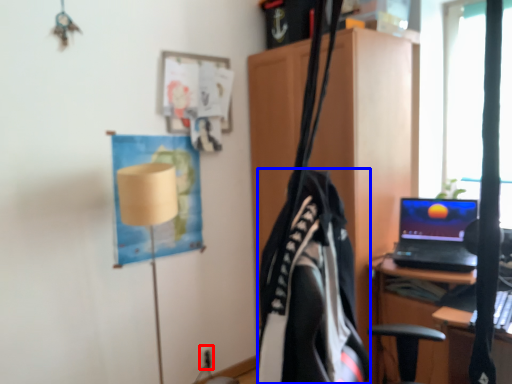
Question: Which object appears farthest to the camera in this image, electric outlet (highlighted by a red box) or clothing (highlighted by a blue box)?

Choices:
 (A) electric outlet
 (B) clothing

Answer: (A)